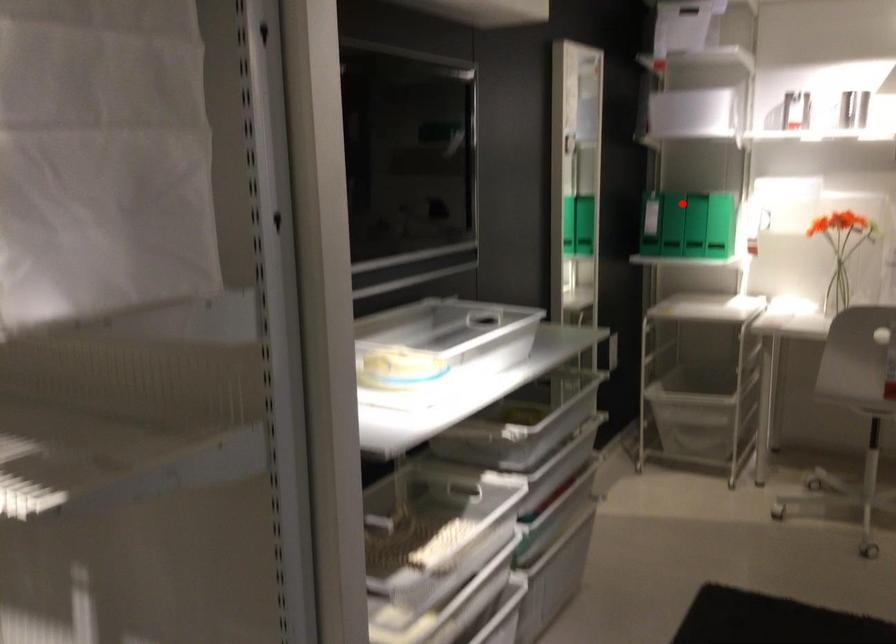
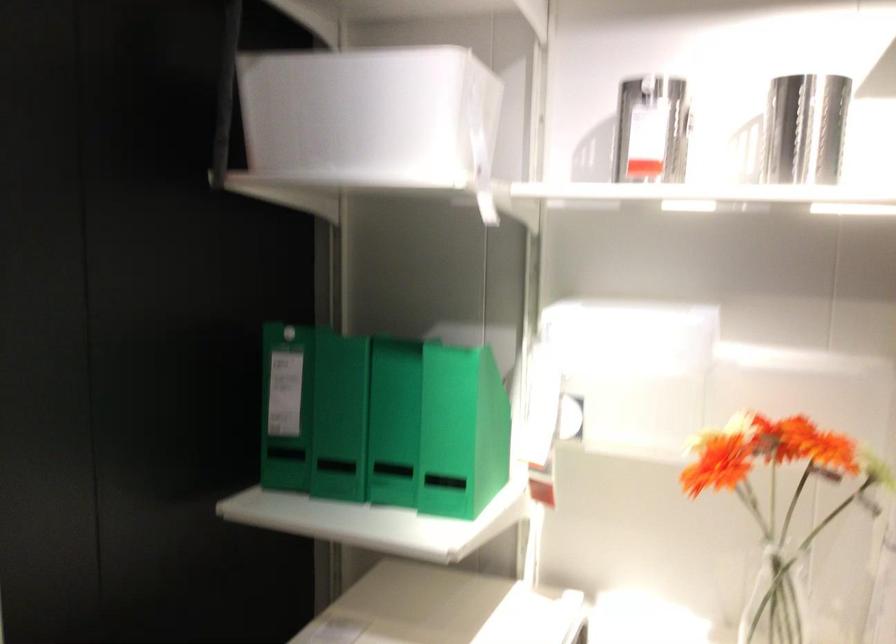
Find the pixel in the second image that matches the highlighted location in the first image.

(286, 406)